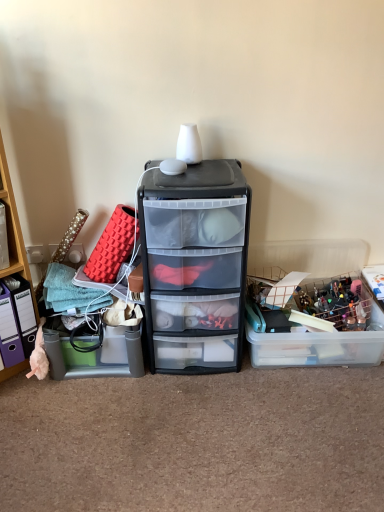
Find the location of a particular element. This screenshot has height=512, width=384. teal plastic bin at left is located at coordinates (13, 228).

What do you see at coordinates (319, 346) in the screenshot? I see `translucent plastic storage box at right, arranged as the second storage box when viewed from the left` at bounding box center [319, 346].

You are a GUI agent. You are given a task and a screenshot of the screen. Output one action in this format:
    pyautogui.click(x=<x>, y=<y>)
    Task: Click on the translucent plastic storage box at left, which appears as the 1th storage box when viewed from the left
    Image resolution: width=384 pixels, height=512 pixels.
    Given the screenshot: What is the action you would take?
    pyautogui.click(x=95, y=353)

Locate an element on the screen. The height and width of the screenshot is (512, 384). teal plastic bin at left is located at coordinates (13, 228).

In the image, there is a translucent plastic storage box at right, arranged as the second storage box when viewed from the left. Where is `storage box below it (from the image's perspective)`? The height and width of the screenshot is (512, 384). storage box below it (from the image's perspective) is located at coordinates (95, 353).

Who is taller, translucent plastic storage box at right, the first storage box viewed from the right, or translucent plastic storage box at left, which appears as the 1th storage box when viewed from the left?

translucent plastic storage box at left, which appears as the 1th storage box when viewed from the left, is taller.

Can you confirm if translucent plastic storage box at right, arranged as the second storage box when viewed from the left, is positioned to the right of translucent plastic storage box at left, which appears as the 1th storage box when viewed from the left?

Yes.

What's the angular difference between teal plastic bin at left and translucent plastic storage box at left, which is counted as the 2th storage box, starting from the right,'s facing directions?

41.9 degrees.

Which object is further away from the camera taking this photo, teal plastic bin at left or translucent plastic storage box at left, which is counted as the 2th storage box, starting from the right?

translucent plastic storage box at left, which is counted as the 2th storage box, starting from the right, is further away from the camera.

Which is behind, point (16, 238) or point (110, 331)?

The point (110, 331) is more distant.

Find the location of a particular element. The image size is (384, 512). the 2nd storage box below the teal plastic bin at left (from the image's perspective) is located at coordinates (95, 353).

Visually, is translucent plastic storage box at right, arranged as the second storage box when viewed from the left, positioned to the left or to the right of transparent plastic drawer at center?

In the image, translucent plastic storage box at right, arranged as the second storage box when viewed from the left, appears on the right side of transparent plastic drawer at center.

Which object is wider, translucent plastic storage box at right, arranged as the second storage box when viewed from the left, or transparent plastic drawer at center?

translucent plastic storage box at right, arranged as the second storage box when viewed from the left, is wider.

From the image's perspective, does translucent plastic storage box at right, the first storage box viewed from the right, appear higher than transparent plastic drawer at center?

No.

Is translucent plastic storage box at right, the first storage box viewed from the right, oriented towards transparent plastic drawer at center?

No, translucent plastic storage box at right, the first storage box viewed from the right, is not oriented towards transparent plastic drawer at center.

Is translucent plastic storage box at right, arranged as the second storage box when viewed from the left, taller or shorter than teal plastic bin at left?

In the image, translucent plastic storage box at right, arranged as the second storage box when viewed from the left, appears to be shorter than teal plastic bin at left.

Which is behind, point (263, 255) or point (9, 198)?

The point (263, 255) is behind.

Would you consider translucent plastic storage box at right, arranged as the second storage box when viewed from the left, to be distant from teal plastic bin at left?

Yes, translucent plastic storage box at right, arranged as the second storage box when viewed from the left, and teal plastic bin at left are quite far apart.

Which is correct: translucent plastic storage box at left, which appears as the 1th storage box when viewed from the left, is inside transparent plastic drawer at center, or outside of it?

translucent plastic storage box at left, which appears as the 1th storage box when viewed from the left, is not enclosed by transparent plastic drawer at center.

Is translucent plastic storage box at left, which is counted as the 2th storage box, starting from the right, facing away from transparent plastic drawer at center?

No, transparent plastic drawer at center is not at the back of translucent plastic storage box at left, which is counted as the 2th storage box, starting from the right.

How much distance is there between translucent plastic storage box at left, which is counted as the 2th storage box, starting from the right, and transparent plastic drawer at center?

33.33 centimeters.

Which object is positioned more to the left, translucent plastic storage box at left, which is counted as the 2th storage box, starting from the right, or transparent plastic drawer at center?

translucent plastic storage box at left, which is counted as the 2th storage box, starting from the right, is more to the left.

Can you tell me how much transparent plastic drawer at center and teal plastic bin at left differ in facing direction?

The angle between the facing direction of transparent plastic drawer at center and the facing direction of teal plastic bin at left is 43.5 degrees.

Is transparent plastic drawer at center inside or outside of teal plastic bin at left?

transparent plastic drawer at center is located beyond the bounds of teal plastic bin at left.

Is transparent plastic drawer at center to the left of teal plastic bin at left from the viewer's perspective?

In fact, transparent plastic drawer at center is to the right of teal plastic bin at left.

Would you say translucent plastic storage box at left, which is counted as the 2th storage box, starting from the right, is part of transparent plastic drawer at center's contents?

No, translucent plastic storage box at left, which is counted as the 2th storage box, starting from the right, is not inside transparent plastic drawer at center.

Consider the image. From a real-world perspective, which object rests below the other?

In real-world perspective, translucent plastic storage box at left, which appears as the 1th storage box when viewed from the left, is lower.

Locate an element on the screen. The height and width of the screenshot is (512, 384). filing cabinet above the translucent plastic storage box at left, which is counted as the 2th storage box, starting from the right (from the image's perspective) is located at coordinates (195, 266).

Could you measure the distance between transparent plastic drawer at center and translucent plastic storage box at left, which appears as the 1th storage box when viewed from the left?

transparent plastic drawer at center is 13.12 inches from translucent plastic storage box at left, which appears as the 1th storage box when viewed from the left.

Find the location of a particular element. Image resolution: width=384 pixels, height=512 pixels. storage box that appears above the translucent plastic storage box at right, arranged as the second storage box when viewed from the left (from a real-world perspective) is located at coordinates (95, 353).

This screenshot has height=512, width=384. In order to click on storage box that is the 1st object directly below the teal plastic bin at left (from a real-world perspective) in this screenshot , I will do `click(95, 353)`.

Looking at this image, from the image, which object appears to be farther from translucent plastic storage box at right, arranged as the second storage box when viewed from the left, teal plastic bin at left or translucent plastic storage box at left, which appears as the 1th storage box when viewed from the left?

teal plastic bin at left is further to translucent plastic storage box at right, arranged as the second storage box when viewed from the left.

Based on their spatial positions, is translucent plastic storage box at left, which appears as the 1th storage box when viewed from the left, or transparent plastic drawer at center closer to translucent plastic storage box at right, arranged as the second storage box when viewed from the left?

transparent plastic drawer at center is positioned closer to the anchor translucent plastic storage box at right, arranged as the second storage box when viewed from the left.

From the image, which object appears to be nearer to translucent plastic storage box at left, which appears as the 1th storage box when viewed from the left, teal plastic bin at left or transparent plastic drawer at center?

Based on the image, teal plastic bin at left appears to be nearer to translucent plastic storage box at left, which appears as the 1th storage box when viewed from the left.

Which object lies nearer to the anchor point teal plastic bin at left, transparent plastic drawer at center or translucent plastic storage box at left, which is counted as the 2th storage box, starting from the right?

Based on the image, translucent plastic storage box at left, which is counted as the 2th storage box, starting from the right, appears to be nearer to teal plastic bin at left.

Which object lies nearer to the anchor point transparent plastic drawer at center, translucent plastic storage box at right, arranged as the second storage box when viewed from the left, or teal plastic bin at left?

Among the two, translucent plastic storage box at right, arranged as the second storage box when viewed from the left, is located nearer to transparent plastic drawer at center.

When comparing their distances from translucent plastic storage box at right, the first storage box viewed from the right, does teal plastic bin at left or transparent plastic drawer at center seem closer?

transparent plastic drawer at center is positioned closer to the anchor translucent plastic storage box at right, the first storage box viewed from the right.

Based on their spatial positions, is transparent plastic drawer at center or translucent plastic storage box at right, the first storage box viewed from the right, closer to translucent plastic storage box at left, which is counted as the 2th storage box, starting from the right?

Among the two, transparent plastic drawer at center is located nearer to translucent plastic storage box at left, which is counted as the 2th storage box, starting from the right.

Based on their spatial positions, is teal plastic bin at left or translucent plastic storage box at right, arranged as the second storage box when viewed from the left, closer to transparent plastic drawer at center?

translucent plastic storage box at right, arranged as the second storage box when viewed from the left, lies closer to transparent plastic drawer at center than the other object.

Find the location of a particular element. Image resolution: width=384 pixels, height=512 pixels. filing cabinet between teal plastic bin at left and translucent plastic storage box at right, the first storage box viewed from the right, from left to right is located at coordinates (195, 266).

Where is `storage box between teal plastic bin at left and transparent plastic drawer at center from left to right`? storage box between teal plastic bin at left and transparent plastic drawer at center from left to right is located at coordinates (95, 353).

At what (x,y) coordinates should I click in order to perform the action: click on filing cabinet between translucent plastic storage box at left, which appears as the 1th storage box when viewed from the left, and translucent plastic storage box at right, arranged as the second storage box when viewed from the left. Please return your answer as a coordinate pair (x, y). Looking at the image, I should click on (195, 266).

Find the location of a particular element. The image size is (384, 512). storage box between teal plastic bin at left and translucent plastic storage box at right, the first storage box viewed from the right is located at coordinates (95, 353).